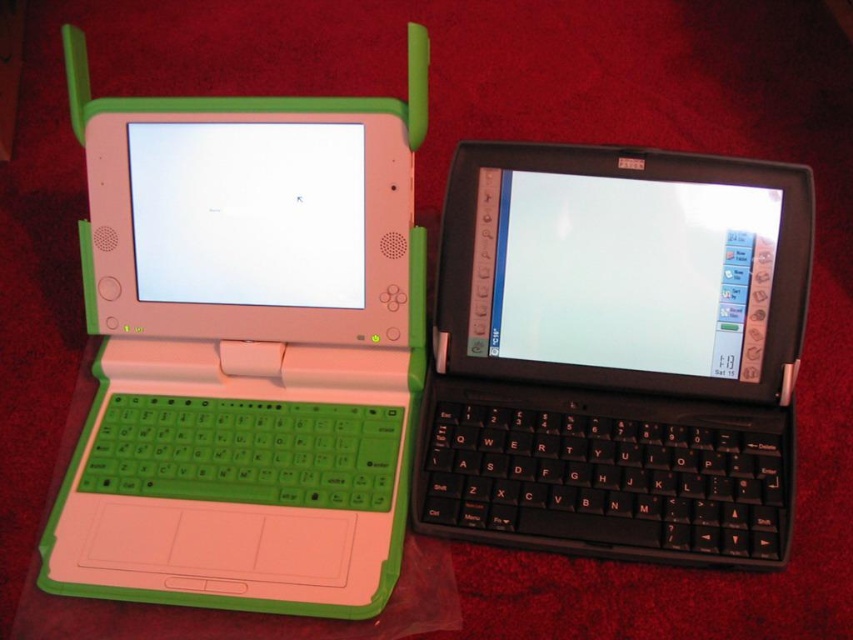
Does green matte laptop at left appear under black matte keyboard at center?

Actually, green matte laptop at left is above black matte keyboard at center.

Is point (206, 310) farther from camera compared to point (781, 525)?

Yes, it is.

Is point (230, 296) closer to viewer compared to point (717, 484)?

No, it is not.

Find the location of `green matte laptop at left`. green matte laptop at left is located at coordinates (245, 349).